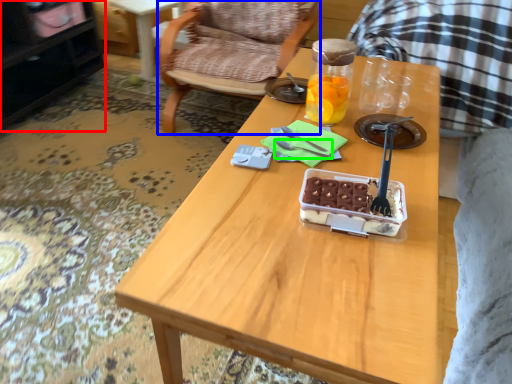
Question: Which object is positioned closest to cabinetry (highlighted by a red box)? Select from chair (highlighted by a blue box) and fork (highlighted by a green box).

Choices:
 (A) chair
 (B) fork

Answer: (A)